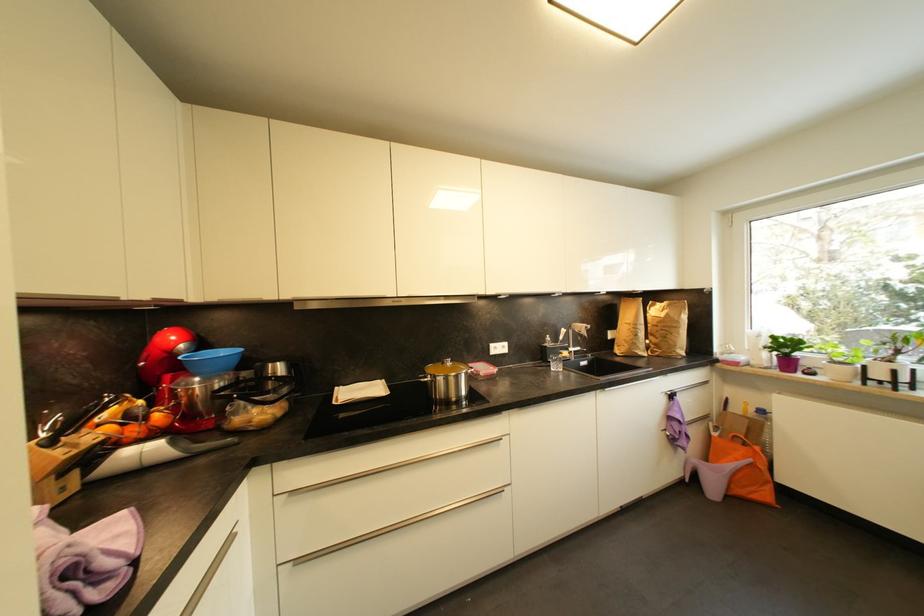
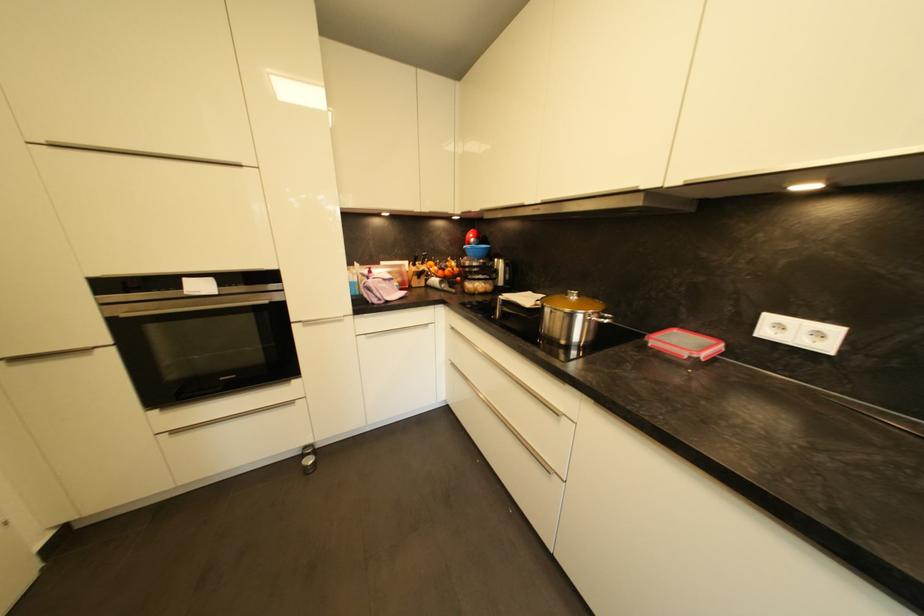
The point at (488, 371) is marked in the first image. Where is the corresponding point in the second image?

(686, 345)